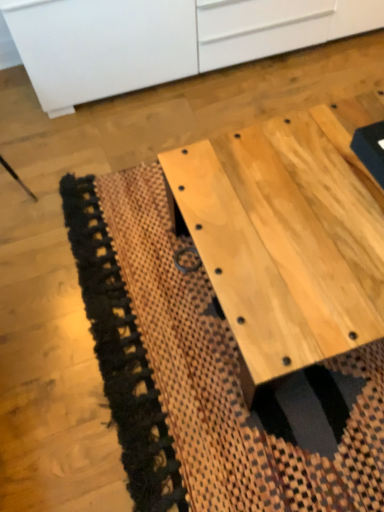
Question: From their relative heights in the image, would you say natural wood table at center is taller or shorter than white matte cabinet at upper center?

Choices:
 (A) short
 (B) tall

Answer: (A)

Question: Considering their positions, is natural wood table at center located in front of or behind white matte cabinet at upper center?

Choices:
 (A) front
 (B) behind

Answer: (A)

Question: Which object is the farthest from the natural wood table at center?

Choices:
 (A) white matte cabinet at upper center
 (B) natural woven mat at center

Answer: (A)

Question: Which of these objects is positioned farthest from the natural woven mat at center?

Choices:
 (A) natural wood table at center
 (B) white matte cabinet at upper center

Answer: (B)